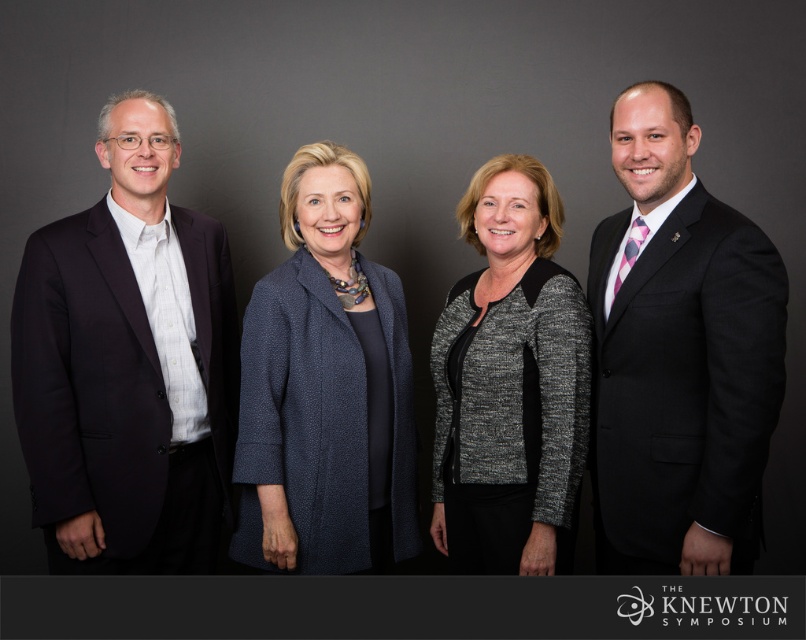
Question: Which of the following is the closest to the observer?

Choices:
 (A) (671, 296)
 (B) (308, 176)
 (C) (439, 410)
 (D) (84, 294)

Answer: (A)

Question: Observing the image, what is the correct spatial positioning of black suit at right in reference to blue textured coat at center?

Choices:
 (A) below
 (B) above

Answer: (B)

Question: Estimate the real-world distances between objects in this image. Which object is closer to the black suit at right?

Choices:
 (A) blue textured coat at center
 (B) gray textured blazer at center
 (C) dark blue suit at left

Answer: (B)

Question: Is dark blue suit at left to the left of gray textured blazer at center from the viewer's perspective?

Choices:
 (A) no
 (B) yes

Answer: (B)

Question: Can you confirm if dark blue suit at left is wider than gray textured blazer at center?

Choices:
 (A) yes
 (B) no

Answer: (A)

Question: Which point is closer to the camera?

Choices:
 (A) gray textured blazer at center
 (B) black suit at right
 (C) blue textured coat at center

Answer: (B)